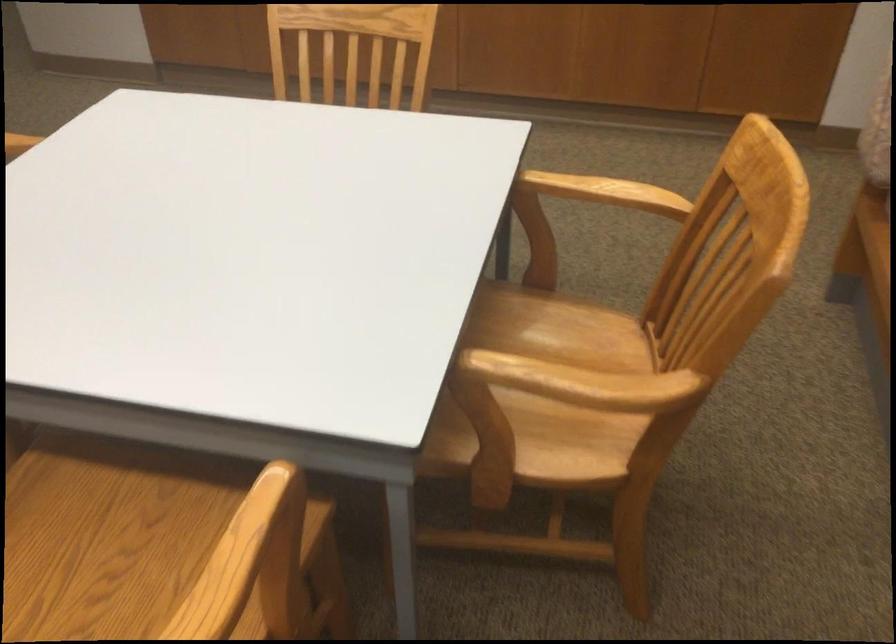
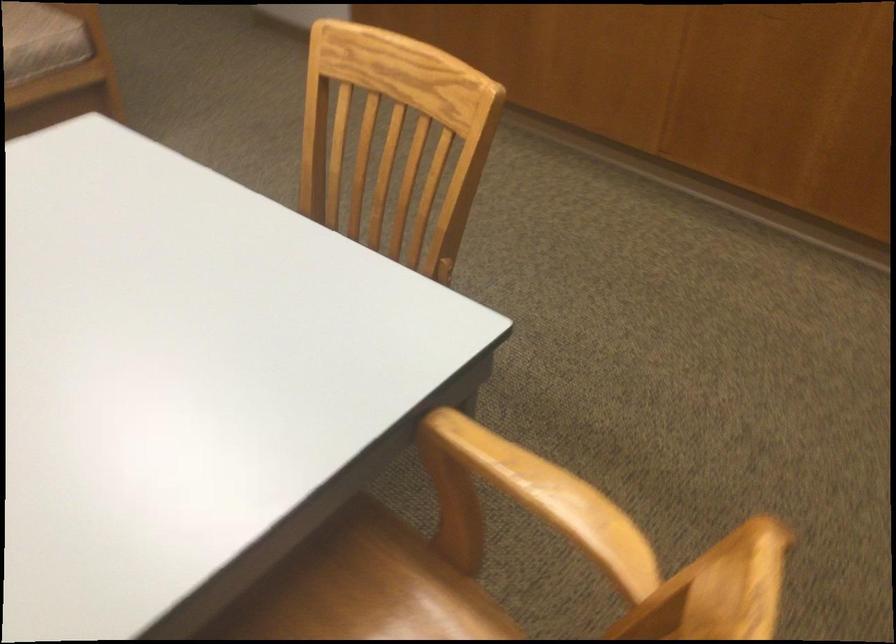
The images are taken continuously from a first-person perspective. In which direction are you moving?

The cameraman moved toward right, forward.